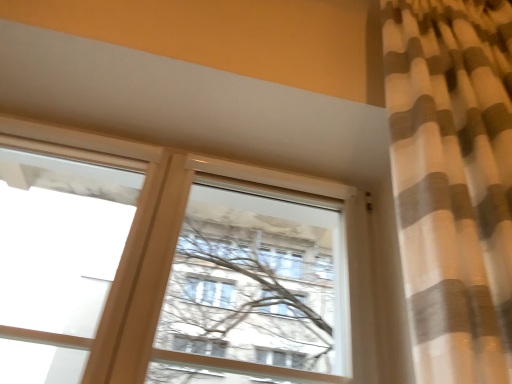
What do you see at coordinates (164, 266) in the screenshot? I see `white matte window at center, which is counted as the second window, starting from the left` at bounding box center [164, 266].

Find the location of `white matte window at center, which is counted as the second window, starting from the left`. white matte window at center, which is counted as the second window, starting from the left is located at coordinates (164, 266).

At what (x,y) coordinates should I click in order to perform the action: click on transparent glass window at upper left, the second window from the right. Please return your answer as a coordinate pair (x, y). Looking at the image, I should click on (58, 254).

Image resolution: width=512 pixels, height=384 pixels. What do you see at coordinates (58, 254) in the screenshot?
I see `transparent glass window at upper left, the second window from the right` at bounding box center [58, 254].

Where is `white matte window at center, which is counted as the second window, starting from the left`? Image resolution: width=512 pixels, height=384 pixels. white matte window at center, which is counted as the second window, starting from the left is located at coordinates (164, 266).

Can you confirm if transparent glass window at upper left, the second window from the right, is positioned to the right of white matte window at center, which is counted as the second window, starting from the left?

Incorrect, transparent glass window at upper left, the second window from the right, is not on the right side of white matte window at center, which is counted as the second window, starting from the left.

Is the position of transparent glass window at upper left, which is the 1th window in left-to-right order, more distant than that of white matte window at center, arranged as the first window when viewed from the right?

No, transparent glass window at upper left, which is the 1th window in left-to-right order, is in front of white matte window at center, arranged as the first window when viewed from the right.

Which is less distant, (125, 211) or (106, 318)?

Point (125, 211) is farther from the camera than point (106, 318).

From the image's perspective, who appears lower, transparent glass window at upper left, which is the 1th window in left-to-right order, or white matte window at center, arranged as the first window when viewed from the right?

white matte window at center, arranged as the first window when viewed from the right, appears lower in the image.

From a real-world perspective, is transparent glass window at upper left, the second window from the right, physically above white matte window at center, which is counted as the second window, starting from the left?

No, from a real-world perspective, transparent glass window at upper left, the second window from the right, is not above white matte window at center, which is counted as the second window, starting from the left.

Is transparent glass window at upper left, the second window from the right, wider than white matte window at center, which is counted as the second window, starting from the left?

No, transparent glass window at upper left, the second window from the right, is not wider than white matte window at center, which is counted as the second window, starting from the left.

Considering the sizes of transparent glass window at upper left, which is the 1th window in left-to-right order, and white matte window at center, arranged as the first window when viewed from the right, in the image, is transparent glass window at upper left, which is the 1th window in left-to-right order, taller or shorter than white matte window at center, arranged as the first window when viewed from the right,?

transparent glass window at upper left, which is the 1th window in left-to-right order, is taller than white matte window at center, arranged as the first window when viewed from the right.

Who is bigger, transparent glass window at upper left, the second window from the right, or white matte window at center, which is counted as the second window, starting from the left?

white matte window at center, which is counted as the second window, starting from the left, is bigger.

Is transparent glass window at upper left, the second window from the right, positioned beyond the bounds of white matte window at center, arranged as the first window when viewed from the right?

Yes, transparent glass window at upper left, the second window from the right, is located beyond the bounds of white matte window at center, arranged as the first window when viewed from the right.

Is transparent glass window at upper left, the second window from the right, placed right next to white matte window at center, arranged as the first window when viewed from the right?

They are not placed beside each other.

Is transparent glass window at upper left, which is the 1th window in left-to-right order, aimed at white matte window at center, which is counted as the second window, starting from the left?

No, transparent glass window at upper left, which is the 1th window in left-to-right order, does not turn towards white matte window at center, which is counted as the second window, starting from the left.

What's the angular difference between transparent glass window at upper left, the second window from the right, and white matte window at center, which is counted as the second window, starting from the left,'s facing directions?

0.00242 degrees separate the facing orientations of transparent glass window at upper left, the second window from the right, and white matte window at center, which is counted as the second window, starting from the left.

Locate an element on the screen. The height and width of the screenshot is (384, 512). window on the right of transparent glass window at upper left, which is the 1th window in left-to-right order is located at coordinates (164, 266).

Can you confirm if white matte window at center, arranged as the first window when viewed from the right, is positioned to the left of transparent glass window at upper left, the second window from the right?

No.

Relative to transparent glass window at upper left, the second window from the right, is white matte window at center, which is counted as the second window, starting from the left, in front or behind?

white matte window at center, which is counted as the second window, starting from the left, is behind transparent glass window at upper left, the second window from the right.

Which is further, (54,320) or (139,177)?

Point (54,320)

From the image's perspective, which is below, white matte window at center, arranged as the first window when viewed from the right, or transparent glass window at upper left, which is the 1th window in left-to-right order?

white matte window at center, arranged as the first window when viewed from the right, appears lower in the image.

From a real-world perspective, is white matte window at center, which is counted as the second window, starting from the left, located higher than transparent glass window at upper left, which is the 1th window in left-to-right order?

Indeed, from a real-world perspective, white matte window at center, which is counted as the second window, starting from the left, stands above transparent glass window at upper left, which is the 1th window in left-to-right order.

Between white matte window at center, arranged as the first window when viewed from the right, and transparent glass window at upper left, which is the 1th window in left-to-right order, which one has smaller width?

transparent glass window at upper left, which is the 1th window in left-to-right order, is thinner.

Considering the relative sizes of white matte window at center, which is counted as the second window, starting from the left, and transparent glass window at upper left, the second window from the right, in the image provided, is white matte window at center, which is counted as the second window, starting from the left, taller than transparent glass window at upper left, the second window from the right,?

No.

Does white matte window at center, arranged as the first window when viewed from the right, have a larger size compared to transparent glass window at upper left, which is the 1th window in left-to-right order?

Correct, white matte window at center, arranged as the first window when viewed from the right, is larger in size than transparent glass window at upper left, which is the 1th window in left-to-right order.

Would you say white matte window at center, arranged as the first window when viewed from the right, contains transparent glass window at upper left, which is the 1th window in left-to-right order?

Definitely not — transparent glass window at upper left, which is the 1th window in left-to-right order, is not inside white matte window at center, arranged as the first window when viewed from the right.

Is white matte window at center, arranged as the first window when viewed from the right, next to transparent glass window at upper left, which is the 1th window in left-to-right order, and touching it?

white matte window at center, arranged as the first window when viewed from the right, and transparent glass window at upper left, which is the 1th window in left-to-right order, are not in contact.

Is white matte window at center, which is counted as the second window, starting from the left, looking in the opposite direction of transparent glass window at upper left, the second window from the right?

That's not correct — white matte window at center, which is counted as the second window, starting from the left, is not looking away from transparent glass window at upper left, the second window from the right.

Looking at this image, how different are the orientations of white matte window at center, arranged as the first window when viewed from the right, and transparent glass window at upper left, the second window from the right, in degrees?

They differ by 0.00242 degrees in their facing directions.

At what (x,y) coordinates should I click in order to perform the action: click on window behind the transparent glass window at upper left, the second window from the right. Please return your answer as a coordinate pair (x, y). This screenshot has width=512, height=384. Looking at the image, I should click on (164, 266).

Image resolution: width=512 pixels, height=384 pixels. I want to click on window that appears behind the transparent glass window at upper left, which is the 1th window in left-to-right order, so click(164, 266).

Locate an element on the screen. window above the white matte window at center, which is counted as the second window, starting from the left (from the image's perspective) is located at coordinates (58, 254).